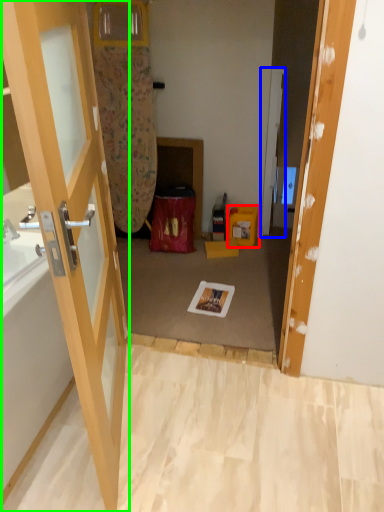
Question: Which object is positioned farthest from box (highlighted by a red box)? Select from door (highlighted by a blue box) and door (highlighted by a green box).

Choices:
 (A) door
 (B) door

Answer: (B)